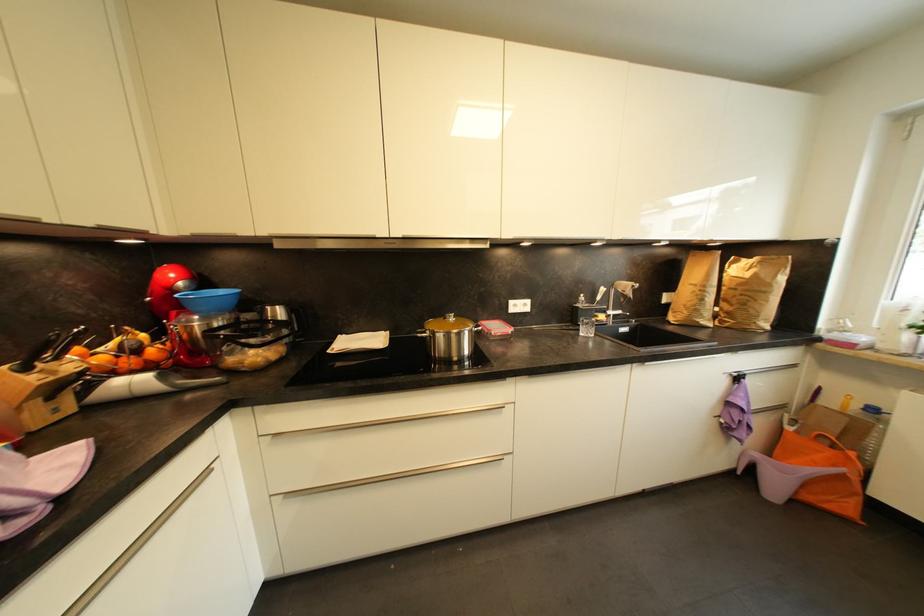
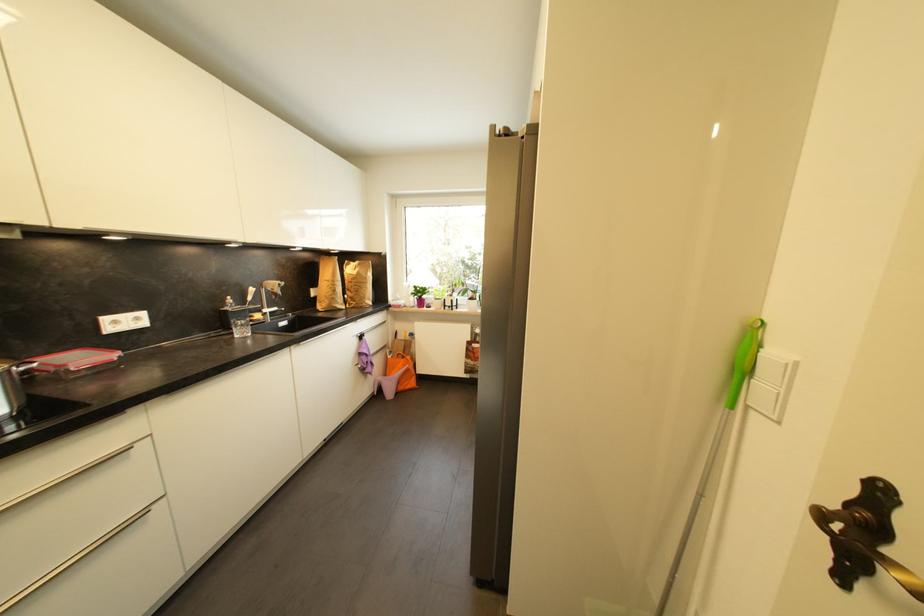
Where in the second image is the point corresponding to (x=590, y=334) from the first image?

(247, 334)